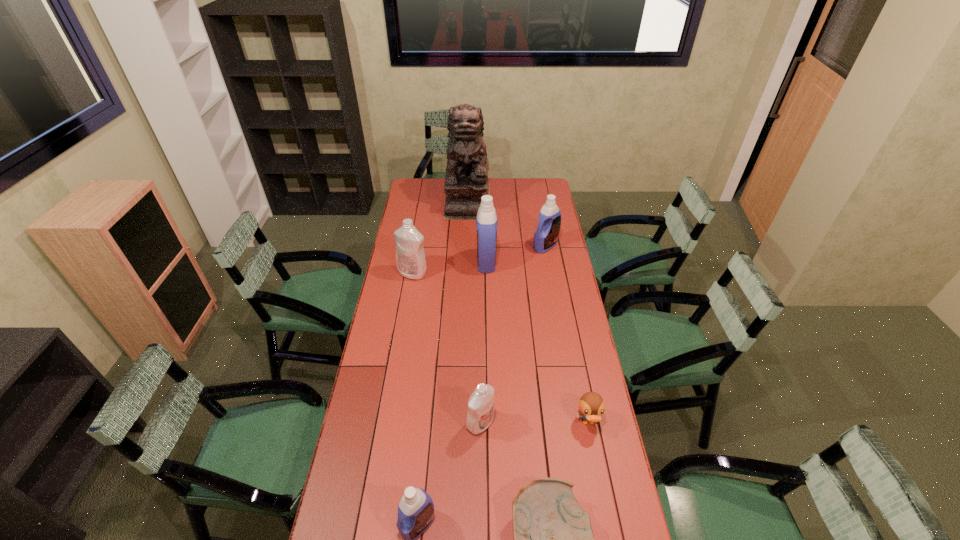
Locate an element on the screen. The height and width of the screenshot is (540, 960). detergent present at the right edge is located at coordinates (545, 238).

Locate an element on the screen. duck located at the right edge is located at coordinates (591, 405).

Where is `vacant region at the far edge of the desktop`? The width and height of the screenshot is (960, 540). vacant region at the far edge of the desktop is located at coordinates (497, 179).

This screenshot has height=540, width=960. What are the coordinates of `vacant space at the left edge of the desktop` in the screenshot? It's located at (396, 312).

You are a GUI agent. You are given a task and a screenshot of the screen. Output one action in this format:
    pyautogui.click(x=<x>, y=<y>)
    Task: Click on the vacant space at the right edge of the desktop
    Image resolution: width=960 pixels, height=540 pixels.
    Given the screenshot: What is the action you would take?
    pyautogui.click(x=554, y=301)

This screenshot has height=540, width=960. I want to click on free space at the far right corner, so click(526, 179).

You are a GUI agent. You are given a task and a screenshot of the screen. Output one action in this format:
    pyautogui.click(x=<x>, y=<y>)
    Task: Click on the free space between the sculpture and the rightmost detergent
    This screenshot has height=540, width=960.
    Given the screenshot: What is the action you would take?
    pyautogui.click(x=507, y=223)

Locate an element on the screen. This screenshot has height=540, width=960. free space between the tallest object and the rightmost blue detergent is located at coordinates click(x=507, y=223).

Image resolution: width=960 pixels, height=540 pixels. I want to click on empty space that is in between the nearer white detergent and the blue duck, so click(534, 423).

This screenshot has height=540, width=960. In order to click on vacant space in between the smaller white detergent and the biggest blue detergent in this screenshot , I will do `click(483, 343)`.